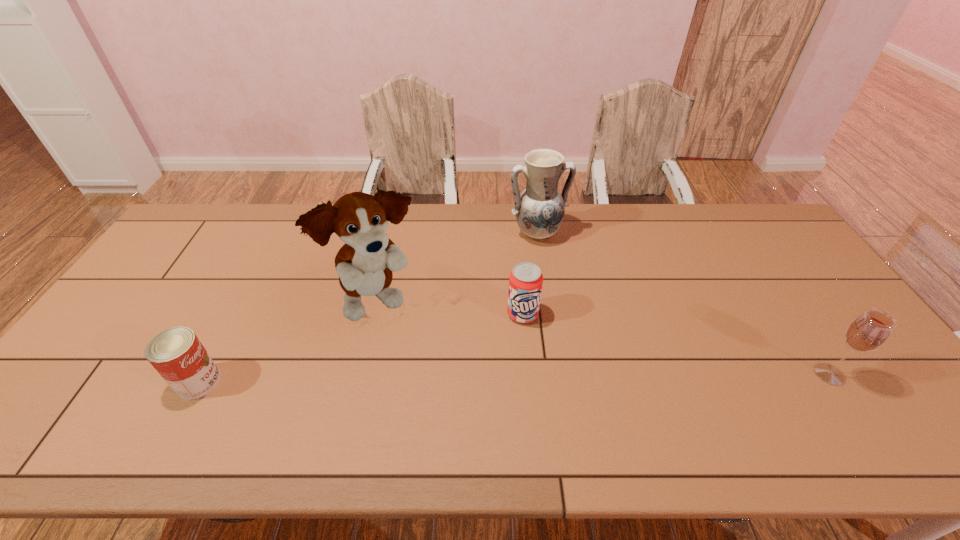
At what (x,y) coordinates should I click in order to perform the action: click on vacant space situated 0.050m on the surface of the soda can. Please return your answer as a coordinate pair (x, y). The image size is (960, 540). Looking at the image, I should click on (523, 340).

At what (x,y) coordinates should I click in order to perform the action: click on free space located on the surface of the soda can. Please return your answer as a coordinate pair (x, y). This screenshot has width=960, height=540. Looking at the image, I should click on (524, 349).

This screenshot has height=540, width=960. What are the coordinates of `free space located on the surface of the soda can` in the screenshot? It's located at (524, 369).

The height and width of the screenshot is (540, 960). I want to click on vacant area located 0.120m on either side of the pottery, so click(x=555, y=273).

Identify the location of blank space located on either side of the pottery. (576, 321).

Locate an element on the screen. This screenshot has width=960, height=540. vacant space situated on either side of the pottery is located at coordinates (566, 301).

Identify the location of free location located on the face of the second object from left to right. The image size is (960, 540). (463, 380).

At what (x,y) coordinates should I click in order to perform the action: click on blank space located 0.260m on the face of the second object from left to right. Please return your answer as a coordinate pair (x, y). Looking at the image, I should click on (468, 386).

The image size is (960, 540). I want to click on vacant point located 0.130m on the face of the second object from left to right, so click(435, 354).

Identify the location of object present at the far edge. This screenshot has width=960, height=540. (539, 209).